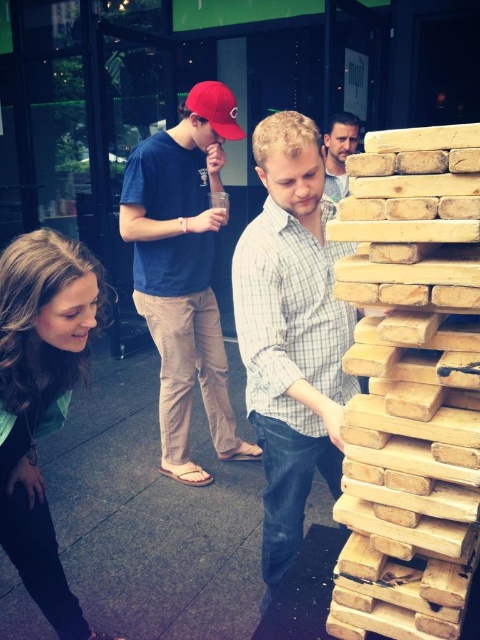
Is natural light wood at center positioned behind red matte baseball cap at upper left?

No, natural light wood at center is in front of red matte baseball cap at upper left.

Is natural light wood at center thinner than red matte baseball cap at upper left?

Correct, natural light wood at center's width is less than red matte baseball cap at upper left's.

Between point (478, 145) and point (244, 134), which one is positioned behind?

Positioned behind is point (244, 134).

Where is `natural light wood at center`? Image resolution: width=480 pixels, height=640 pixels. natural light wood at center is located at coordinates (410, 385).

Can you confirm if natural light wood at center is positioned below green matte shirt at lower left?

No.

Which is behind, point (467, 380) or point (33, 259)?

The point (33, 259) is behind.

I want to click on natural light wood at center, so click(410, 385).

Describe the element at coordinates (40, 401) in the screenshot. I see `green matte shirt at lower left` at that location.

Between green matte shirt at lower left and smooth light blue shirt at upper center, which one appears on the left side from the viewer's perspective?

green matte shirt at lower left

Describe the element at coordinates (40, 401) in the screenshot. I see `green matte shirt at lower left` at that location.

This screenshot has width=480, height=640. Identify the location of green matte shirt at lower left. (40, 401).